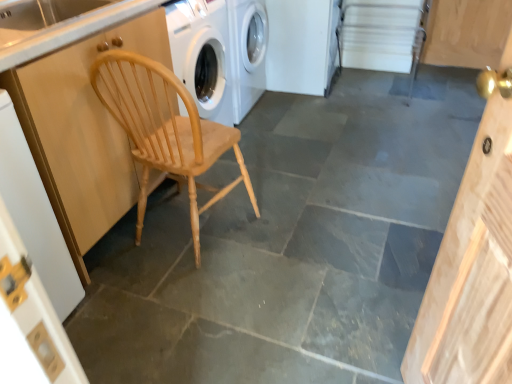
Measure the distance between point (7, 196) and camera.

3.90 feet.

At what (x,y) coordinates should I click in order to perform the action: click on natural wood cabinet at left. Please return your answer as a coordinate pair (x, y). Looking at the image, I should click on (83, 129).

Is natural wood chair at left oriented towards wooden door at left?

No, natural wood chair at left does not turn towards wooden door at left.

Considering their positions, is natural wood chair at left located in front of or behind wooden door at left?

In the image, natural wood chair at left appears behind wooden door at left.

Considering the sizes of objects natural wood chair at left and wooden door at left in the image provided, who is shorter, natural wood chair at left or wooden door at left?

Standing shorter between the two is natural wood chair at left.

How much distance is there between natural wood chair at left and wooden door at left?

natural wood chair at left and wooden door at left are 19.02 inches apart.

Is white glossy counter top at upper left surrounded by wooden door at left?

No, wooden door at left does not contain white glossy counter top at upper left.

Is wooden door at left bigger than white glossy counter top at upper left?

Indeed, wooden door at left has a larger size compared to white glossy counter top at upper left.

Where is `counter top lying above the wooden door at left (from the image's perspective)`? counter top lying above the wooden door at left (from the image's perspective) is located at coordinates (73, 31).

From a real-world perspective, is white glossy counter top at upper left positioned under natural wood cabinet at left based on gravity?

No, from a real-world perspective, white glossy counter top at upper left is not beneath natural wood cabinet at left.

Does white glossy counter top at upper left have a lesser width compared to natural wood cabinet at left?

Yes, white glossy counter top at upper left is thinner than natural wood cabinet at left.

Looking at the image, does white glossy counter top at upper left seem bigger or smaller compared to natural wood cabinet at left?

white glossy counter top at upper left is smaller than natural wood cabinet at left.

Would you say natural wood chair at left is inside or outside white glossy counter top at upper left?

natural wood chair at left is outside white glossy counter top at upper left.

Is natural wood chair at left next to white glossy counter top at upper left and touching it?

natural wood chair at left and white glossy counter top at upper left are clearly separated.

The height and width of the screenshot is (384, 512). In the image, there is a natural wood chair at left. Identify the location of counter top above it (from the image's perspective). (73, 31).

In the scene shown: Between wooden door at left and natural wood cabinet at left, which one has more height?

natural wood cabinet at left is taller.

Consider the image. From a real-world perspective, who is located higher, wooden door at left or natural wood cabinet at left?

natural wood cabinet at left, from a real-world perspective.

Considering the relative sizes of wooden door at left and natural wood cabinet at left in the image provided, is wooden door at left thinner than natural wood cabinet at left?

Yes, wooden door at left is thinner than natural wood cabinet at left.

Considering their positions, is wooden door at left located in front of or behind natural wood chair at left?

Clearly, wooden door at left is in front of natural wood chair at left.

Can you tell me how much wooden door at left and natural wood chair at left differ in facing direction?

The facing directions of wooden door at left and natural wood chair at left are 89 degrees apart.

Considering the relative sizes of wooden door at left and natural wood chair at left in the image provided, is wooden door at left shorter than natural wood chair at left?

Incorrect, the height of wooden door at left does not fall short of that of natural wood chair at left.

From a real-world perspective, which is physically below, wooden door at left or natural wood chair at left?

natural wood chair at left is physically lower.

Who is bigger, natural wood cabinet at left or white glossy counter top at upper left?

With larger size is natural wood cabinet at left.

Does point (93, 46) come behind point (81, 29)?

Yes, it is.

Based on the photo, does natural wood cabinet at left touch white glossy counter top at upper left?

No, natural wood cabinet at left is not beside white glossy counter top at upper left.

Where is `chair on the right of wooden door at left`? The height and width of the screenshot is (384, 512). chair on the right of wooden door at left is located at coordinates (164, 129).

Where is `counter top above the wooden door at left (from the image's perspective)`? The height and width of the screenshot is (384, 512). counter top above the wooden door at left (from the image's perspective) is located at coordinates (73, 31).

Which object lies nearer to the anchor point wooden door at left, natural wood cabinet at left or natural wood chair at left?

natural wood cabinet at left is positioned closer to the anchor wooden door at left.

Based on their spatial positions, is natural wood cabinet at left or natural wood chair at left closer to white glossy counter top at upper left?

Among the two, natural wood cabinet at left is located nearer to white glossy counter top at upper left.

Which object lies further to the anchor point white glossy counter top at upper left, wooden door at left or natural wood cabinet at left?

wooden door at left is positioned further to the anchor white glossy counter top at upper left.

Estimate the real-world distances between objects in this image. Which object is closer to white glossy counter top at upper left, natural wood chair at left or natural wood cabinet at left?

The object closer to white glossy counter top at upper left is natural wood cabinet at left.

From the image, which object appears to be farther from white glossy counter top at upper left, natural wood cabinet at left or wooden door at left?

The object further to white glossy counter top at upper left is wooden door at left.

Considering their positions, is white glossy counter top at upper left positioned closer to wooden door at left than natural wood chair at left?

white glossy counter top at upper left is closer to wooden door at left.

Estimate the real-world distances between objects in this image. Which object is further from natural wood chair at left, natural wood cabinet at left or white glossy counter top at upper left?

white glossy counter top at upper left is positioned further to the anchor natural wood chair at left.

When comparing their distances from white glossy counter top at upper left, does natural wood chair at left or wooden door at left seem closer?

→ Among the two, natural wood chair at left is located nearer to white glossy counter top at upper left.

In order to click on cabinetry situated between wooden door at left and natural wood chair at left from left to right in this screenshot , I will do `click(83, 129)`.

Find the location of a particular element. chair between white glossy counter top at upper left and wooden door at left in the vertical direction is located at coordinates pos(164,129).

At what (x,y) coordinates should I click in order to perform the action: click on counter top between natural wood cabinet at left and natural wood chair at left in the horizontal direction. Please return your answer as a coordinate pair (x, y). Looking at the image, I should click on (73, 31).

Locate an element on the screen. The width and height of the screenshot is (512, 384). cabinetry that lies between white glossy counter top at upper left and wooden door at left from top to bottom is located at coordinates (83, 129).